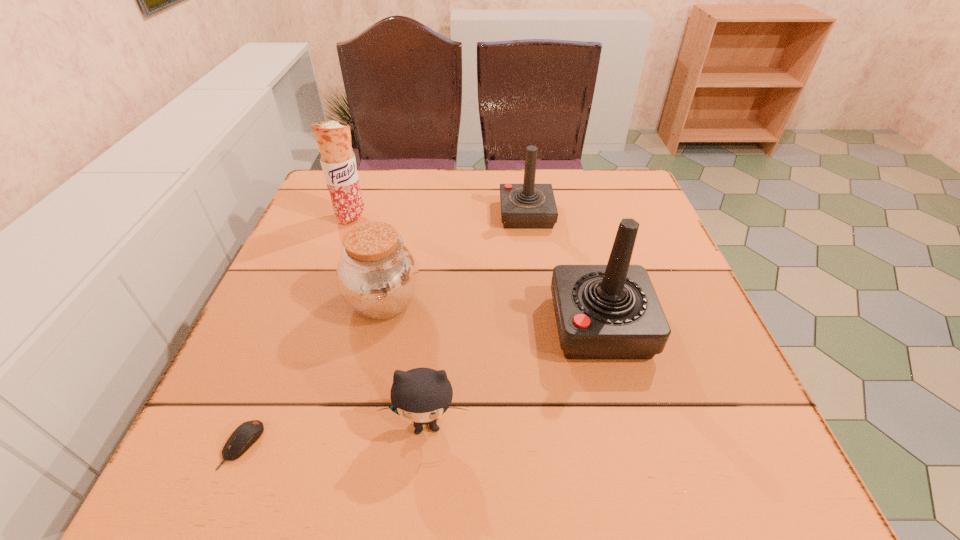
Locate an element on the screen. vacant area that lies between the burrito and the taller joystick is located at coordinates (476, 271).

The width and height of the screenshot is (960, 540). Find the location of `unoccupied area between the jar and the second shortest object`. unoccupied area between the jar and the second shortest object is located at coordinates (405, 363).

Locate an element on the screen. vacant point located between the nearer joystick and the jar is located at coordinates (492, 314).

The width and height of the screenshot is (960, 540). Identify the location of vacant area between the jar and the taller joystick. (492, 314).

This screenshot has height=540, width=960. In order to click on unoccupied position between the kitten and the burrito in this screenshot , I will do `click(390, 321)`.

Identify the location of vacant area that lies between the burrito and the nearer joystick. (476, 271).

The width and height of the screenshot is (960, 540). Find the location of `free space between the computer mouse and the kitten`. free space between the computer mouse and the kitten is located at coordinates (335, 435).

Choose which object is the nearest neighbor to the kitten. Please provide its 2D coordinates. Your answer should be formatted as a tuple, i.e. [(x, y)], where the tuple contains the x and y coordinates of a point satisfying the conditions above.

[(377, 275)]

Identify the location of object that can be found as the fifth closest to the jar. (611, 311).

This screenshot has width=960, height=540. Identify the location of vacant position in the image that satisfies the following two spatial constraints: 1. on the front side of the burrito; 2. on the right side of the jar. (322, 302).